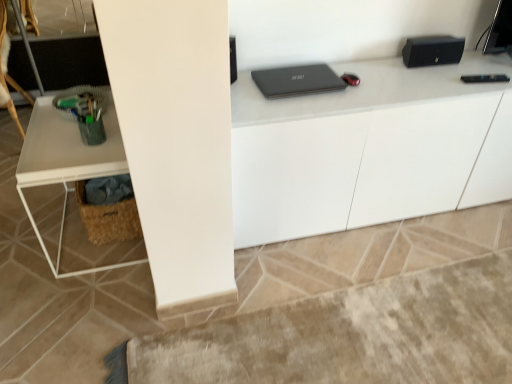
Question: From the image's perspective, is white glossy cabinet at upper center, which appears as the first computer desk when viewed from the right, above white matte table at left, which is the 1th computer desk from left to right?

Choices:
 (A) no
 (B) yes

Answer: (B)

Question: Is white glossy cabinet at upper center, which appears as the first computer desk when viewed from the right, closer to camera compared to white matte table at left, which is the 1th computer desk from left to right?

Choices:
 (A) no
 (B) yes

Answer: (A)

Question: Is white glossy cabinet at upper center, which appears as the first computer desk when viewed from the right, outside white matte table at left, which is the 1th computer desk from left to right?

Choices:
 (A) no
 (B) yes

Answer: (B)

Question: Would you consider white glossy cabinet at upper center, the second computer desk when ordered from left to right, to be distant from white matte table at left, which is the 1th computer desk from left to right?

Choices:
 (A) yes
 (B) no

Answer: (B)

Question: Does white glossy cabinet at upper center, which appears as the first computer desk when viewed from the right, have a greater height compared to white matte table at left, which is the 1th computer desk from left to right?

Choices:
 (A) no
 (B) yes

Answer: (B)

Question: Could you tell me if white glossy cabinet at upper center, the second computer desk when ordered from left to right, is turned towards white matte table at left, which is the 1th computer desk from left to right?

Choices:
 (A) yes
 (B) no

Answer: (B)

Question: Is white glossy cabinet at upper center, the second computer desk when ordered from left to right, not close to woven brown basket at lower left?

Choices:
 (A) no
 (B) yes

Answer: (A)

Question: From a real-world perspective, is white glossy cabinet at upper center, the second computer desk when ordered from left to right, physically above woven brown basket at lower left?

Choices:
 (A) yes
 (B) no

Answer: (A)

Question: Would you say white glossy cabinet at upper center, the second computer desk when ordered from left to right, contains woven brown basket at lower left?

Choices:
 (A) yes
 (B) no

Answer: (B)

Question: Is white glossy cabinet at upper center, the second computer desk when ordered from left to right, turned away from woven brown basket at lower left?

Choices:
 (A) yes
 (B) no

Answer: (B)

Question: Is white glossy cabinet at upper center, the second computer desk when ordered from left to right, not inside woven brown basket at lower left?

Choices:
 (A) yes
 (B) no

Answer: (A)

Question: Can you confirm if white glossy cabinet at upper center, the second computer desk when ordered from left to right, is shorter than woven brown basket at lower left?

Choices:
 (A) yes
 (B) no

Answer: (B)

Question: Is wooden swivel chair at left further to camera compared to woven brown basket at lower left?

Choices:
 (A) no
 (B) yes

Answer: (B)